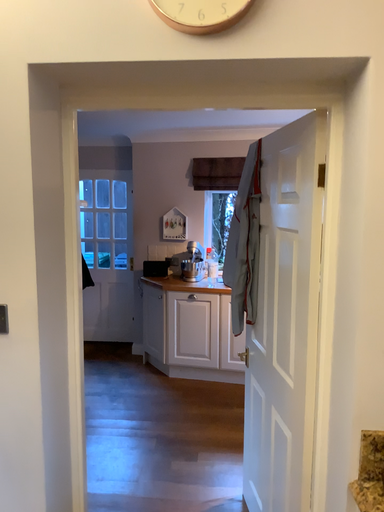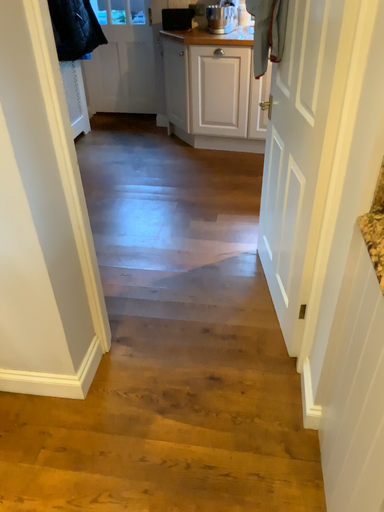
Question: How did the camera likely rotate when shooting the video?

Choices:
 (A) rotated downward
 (B) rotated upward

Answer: (A)